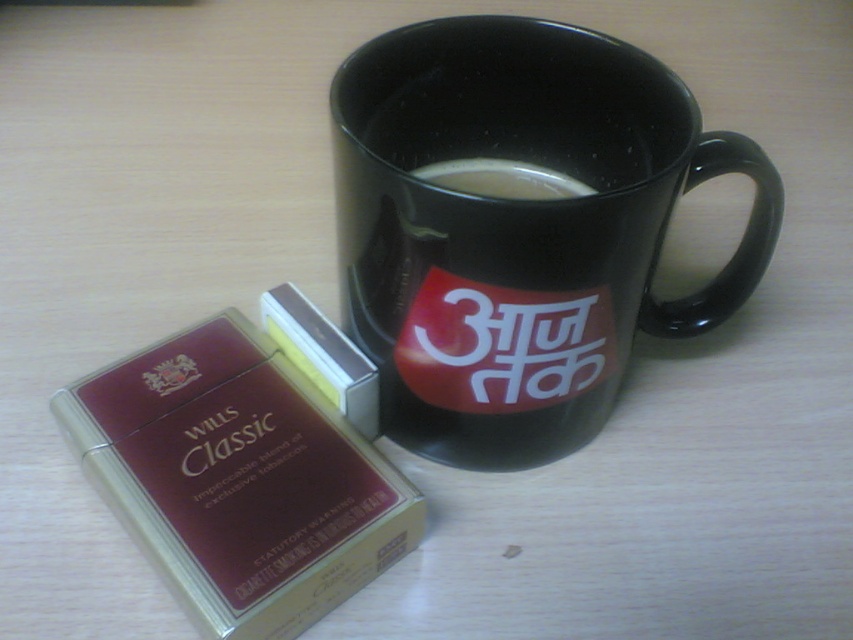
Question: Which of the following is the closest to the observer?

Choices:
 (A) (498, 173)
 (B) (543, 228)

Answer: (B)

Question: In this image, where is black ceramic mug at upper center located relative to white glossy coffee at upper center?

Choices:
 (A) left
 (B) right

Answer: (B)

Question: Which of the following is the closest to the observer?

Choices:
 (A) 387,88
 (B) 518,168

Answer: (A)

Question: Among these objects, which one is nearest to the camera?

Choices:
 (A) white glossy coffee at upper center
 (B) black ceramic mug at upper center

Answer: (B)

Question: From the image, what is the correct spatial relationship of black ceramic mug at upper center in relation to white glossy coffee at upper center?

Choices:
 (A) above
 (B) below

Answer: (B)

Question: Is black ceramic mug at upper center above white glossy coffee at upper center?

Choices:
 (A) yes
 (B) no

Answer: (B)